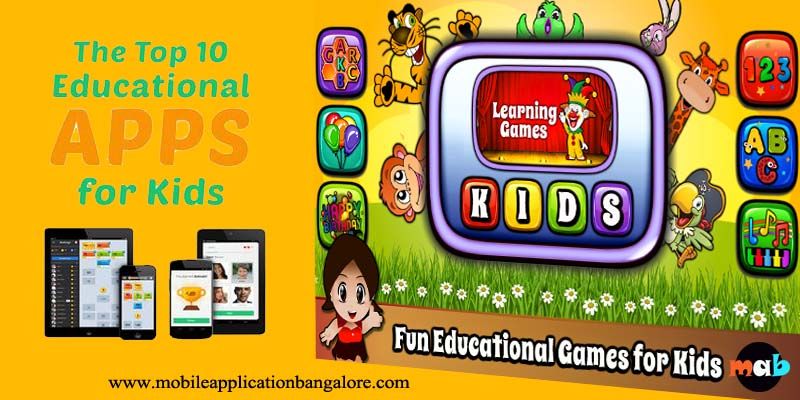
Identify the location of red curtain behind clown. This screenshot has width=800, height=400. (533, 90).